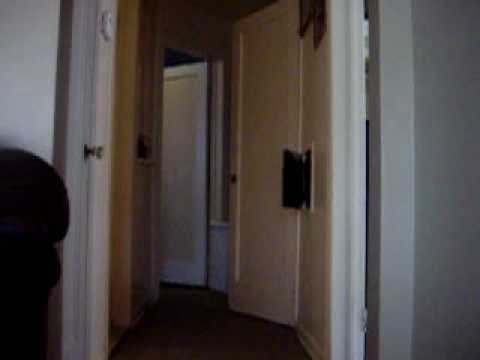
Locate an element on the screen. The image size is (480, 360). door is located at coordinates (256, 197).